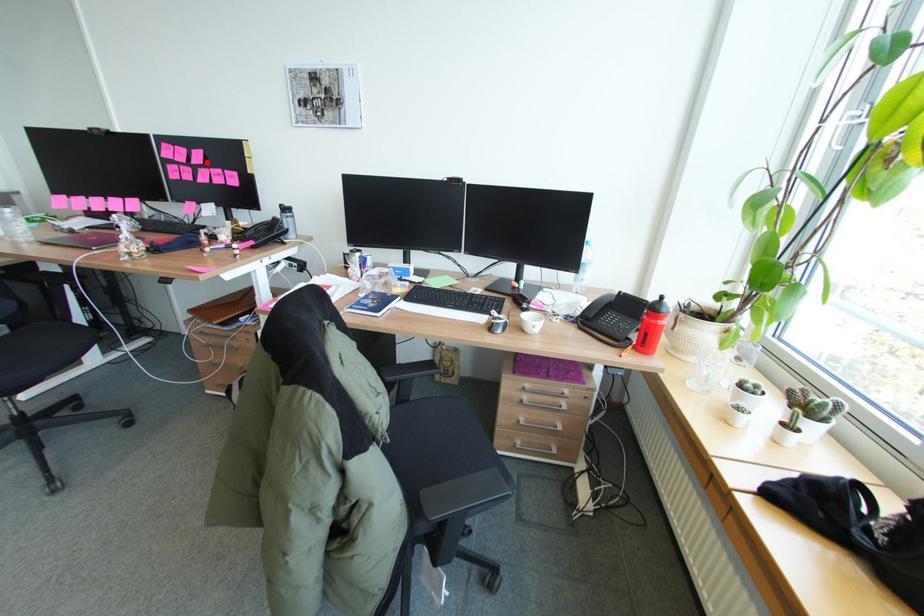
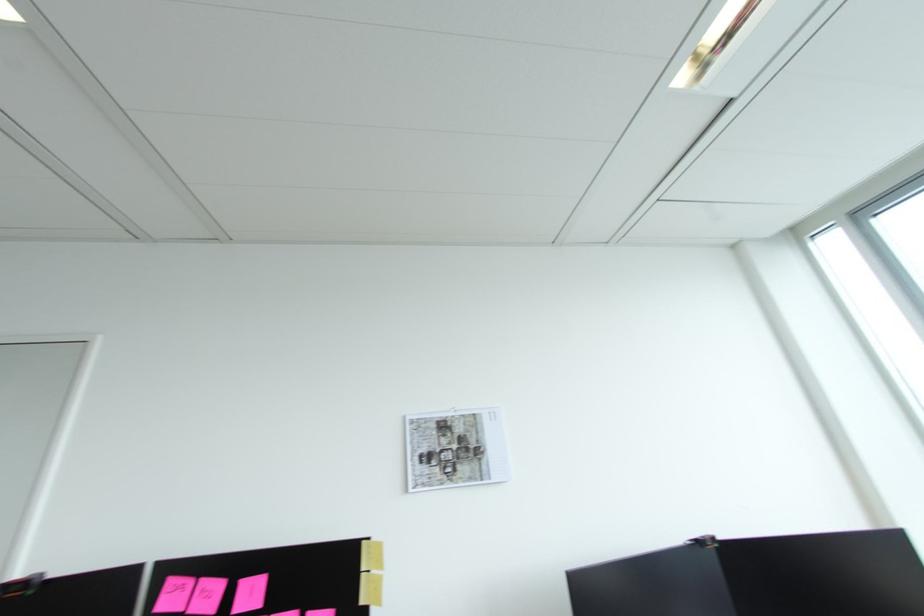
Find the pixel in the second image that matches the highlighted location in the first image.

(262, 605)